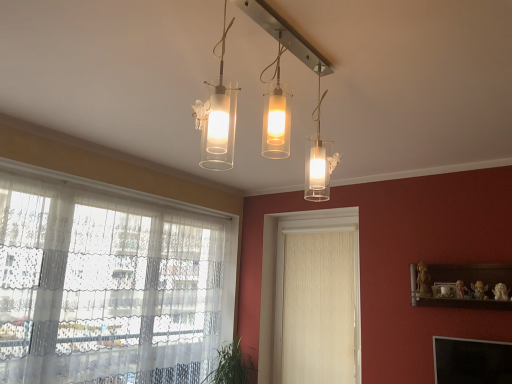
What is the approximate height of white textured curtain at center?

white textured curtain at center is 5.07 feet in height.

This screenshot has width=512, height=384. Describe the element at coordinates (106, 286) in the screenshot. I see `transparent lace curtain at left` at that location.

What are the coordinates of `green leafy plant at lower left` in the screenshot? It's located at (232, 366).

Between transparent lace curtain at left and green leafy plant at lower left, which one has more height?

transparent lace curtain at left.

Is point (122, 251) farther from camera compared to point (225, 376)?

That is False.

Would you say transparent lace curtain at left is a long distance from green leafy plant at lower left?

transparent lace curtain at left is positioned a significant distance from green leafy plant at lower left.

Where is `plant located below the clear glass light fixture at center (from the image's perspective)`? plant located below the clear glass light fixture at center (from the image's perspective) is located at coordinates (232, 366).

Is clear glass light fixture at center at the back of green leafy plant at lower left?

No, green leafy plant at lower left is not facing away from clear glass light fixture at center.

Is green leafy plant at lower left located outside clear glass light fixture at center?

green leafy plant at lower left is positioned outside clear glass light fixture at center.

Between white textured curtain at center and green leafy plant at lower left, which one appears on the left side from the viewer's perspective?

Positioned to the left is green leafy plant at lower left.

What's the angular difference between white textured curtain at center and green leafy plant at lower left's facing directions?

90 degrees.

Looking at the image, does white textured curtain at center seem bigger or smaller compared to green leafy plant at lower left?

white textured curtain at center is smaller than green leafy plant at lower left.

Is white textured curtain at center not near green leafy plant at lower left?

That's not correct — white textured curtain at center is a little close to green leafy plant at lower left.

Is clear glass light fixture at center facing towards white textured curtain at center?

No, clear glass light fixture at center does not turn towards white textured curtain at center.

Considering the relative positions of clear glass light fixture at center and white textured curtain at center in the image provided, is clear glass light fixture at center behind white textured curtain at center?

No.

Which of these two, clear glass light fixture at center or white textured curtain at center, is bigger?

clear glass light fixture at center.

This screenshot has height=384, width=512. I want to click on curtain below the clear glass light fixture at center (from a real-world perspective), so click(319, 308).

Is wooden shelf at right taller than green leafy plant at lower left?

No.

Considering the positions of objects wooden shelf at right and green leafy plant at lower left in the image provided, who is behind, wooden shelf at right or green leafy plant at lower left?

green leafy plant at lower left is further from the camera.

Which of these two, wooden shelf at right or green leafy plant at lower left, is bigger?

Bigger between the two is green leafy plant at lower left.

From the image's perspective, is wooden shelf at right over green leafy plant at lower left?

Yes.

Identify the location of curtain that is below the wooden shelf at right (from the image's perspective). This screenshot has height=384, width=512. (319, 308).

Is white textured curtain at center wider than wooden shelf at right?

No, white textured curtain at center is not wider than wooden shelf at right.

How distant is white textured curtain at center from wooden shelf at right?

A distance of 1.02 meters exists between white textured curtain at center and wooden shelf at right.

Considering the relative sizes of transparent lace curtain at left and clear glass light fixture at center in the image provided, is transparent lace curtain at left taller than clear glass light fixture at center?

Correct, transparent lace curtain at left is much taller as clear glass light fixture at center.

From the image's perspective, which one is positioned higher, transparent lace curtain at left or clear glass light fixture at center?

clear glass light fixture at center, from the image's perspective.

How many degrees apart are the facing directions of transparent lace curtain at left and clear glass light fixture at center?

89.3 degrees separate the facing orientations of transparent lace curtain at left and clear glass light fixture at center.

Considering the relative positions of transparent lace curtain at left and clear glass light fixture at center in the image provided, is transparent lace curtain at left behind clear glass light fixture at center?

Yes, it is behind clear glass light fixture at center.

Identify the location of window above the green leafy plant at lower left (from a real-world perspective). (106, 286).

I want to click on light fixture above the green leafy plant at lower left (from the image's perspective), so click(279, 75).

Considering their positions, is white textured curtain at center positioned closer to wooden shelf at right than green leafy plant at lower left?

white textured curtain at center.

Which object lies further to the anchor point wooden shelf at right, transparent lace curtain at left or green leafy plant at lower left?

The object further to wooden shelf at right is transparent lace curtain at left.

When comparing their distances from green leafy plant at lower left, does wooden shelf at right or transparent lace curtain at left seem closer?

transparent lace curtain at left lies closer to green leafy plant at lower left than the other object.

Looking at the image, which one is located further to clear glass light fixture at center, green leafy plant at lower left or white textured curtain at center?

The object further to clear glass light fixture at center is green leafy plant at lower left.

Estimate the real-world distances between objects in this image. Which object is further from clear glass light fixture at center, wooden shelf at right or transparent lace curtain at left?

Based on the image, transparent lace curtain at left appears to be further to clear glass light fixture at center.

Which object lies further to the anchor point clear glass light fixture at center, white textured curtain at center or transparent lace curtain at left?

white textured curtain at center lies further to clear glass light fixture at center than the other object.

Which object lies nearer to the anchor point transparent lace curtain at left, wooden shelf at right or clear glass light fixture at center?

The object closer to transparent lace curtain at left is clear glass light fixture at center.

Considering their positions, is green leafy plant at lower left positioned closer to white textured curtain at center than transparent lace curtain at left?

green leafy plant at lower left is positioned closer to the anchor white textured curtain at center.

Identify the location of window between clear glass light fixture at center and white textured curtain at center in the front-back direction. (106, 286).

Locate an element on the screen. curtain between transparent lace curtain at left and wooden shelf at right from left to right is located at coordinates tap(319, 308).

At what (x,y) coordinates should I click in order to perform the action: click on curtain positioned between clear glass light fixture at center and green leafy plant at lower left from near to far. Please return your answer as a coordinate pair (x, y). Looking at the image, I should click on (319, 308).

What are the coordinates of `shelf between clear glass light fixture at center and green leafy plant at lower left along the z-axis` in the screenshot? It's located at (462, 285).